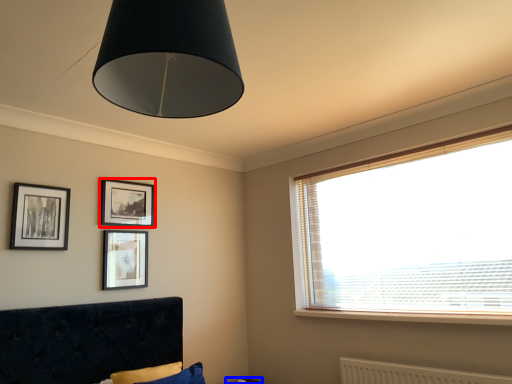
Question: Which of the following is the closest to the observer, picture frame (highlighted by a red box) or table (highlighted by a blue box)?

Choices:
 (A) picture frame
 (B) table

Answer: (A)